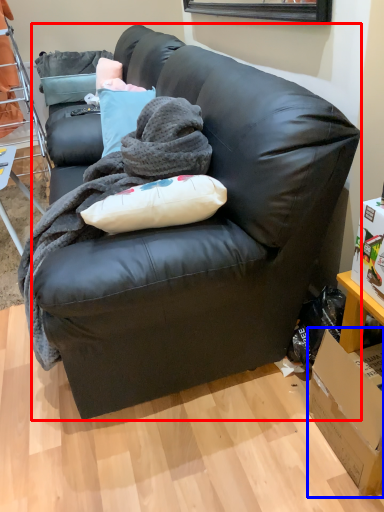
Question: Which of the following is the farthest to the observer, studio couch (highlighted by a red box) or box (highlighted by a blue box)?

Choices:
 (A) studio couch
 (B) box

Answer: (B)